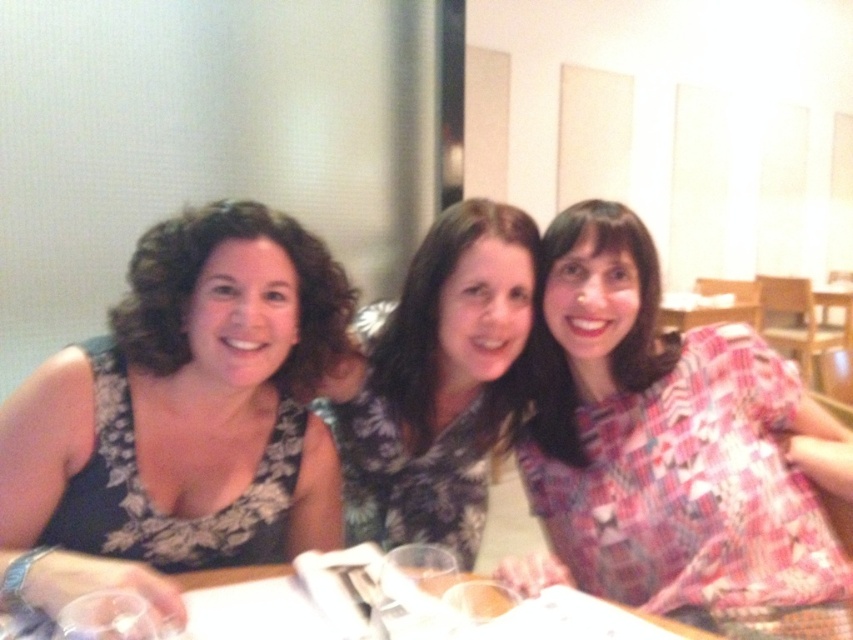
You are a photographer setting up for a group photo. You need to ensure that the floral fabric dress at center and the transparent plastic wine glass at lower left are both visible in the frame. Given their sizes, which object might require more careful positioning to avoid being obscured?

The transparent plastic wine glass at lower left is smaller than the floral fabric dress at center, so it might require more careful positioning to avoid being obscured.

You are standing at the entrance of the restaurant and want to walk to the point marked as point (270, 586). However, there is an obstacle at point (67, 637). Can you reach your destination without passing through the obstacle?

Point (270, 586) is behind point (67, 637), so you can reach it without passing through the obstacle by going around it.